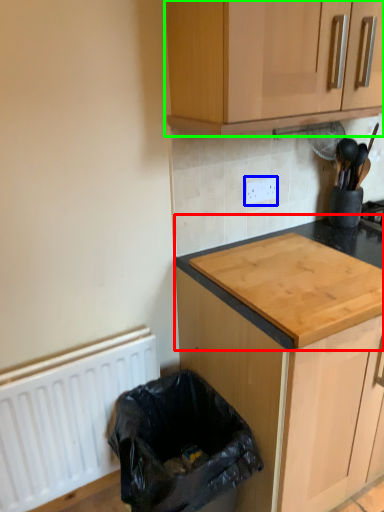
Question: Which object is the closest to the countertop (highlighted by a red box)? Choose among these: electric outlet (highlighted by a blue box) or cabinetry (highlighted by a green box).

Choices:
 (A) electric outlet
 (B) cabinetry

Answer: (A)